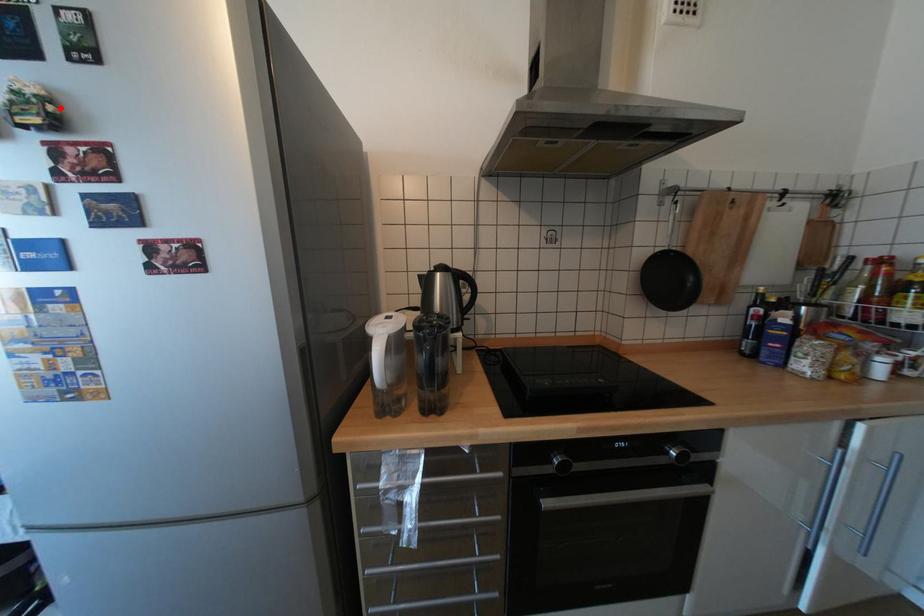
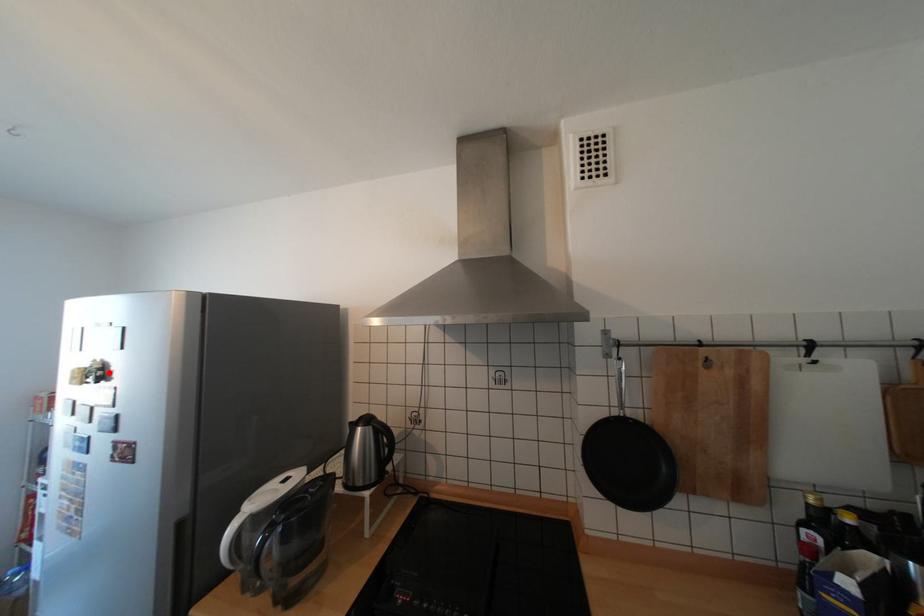
I am providing you with two images of the same scene from different viewpoints. A red point is marked on the first image and another point is marked on the second image. Does the point marked in image1 correspond to the same location as the one in image2?

Yes